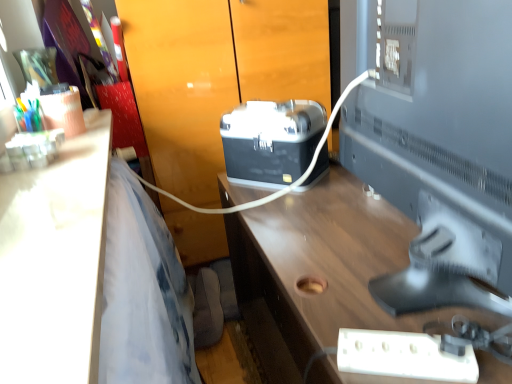
Locate an element on the screen. free space on the front side of black plastic projector at center is located at coordinates (301, 201).